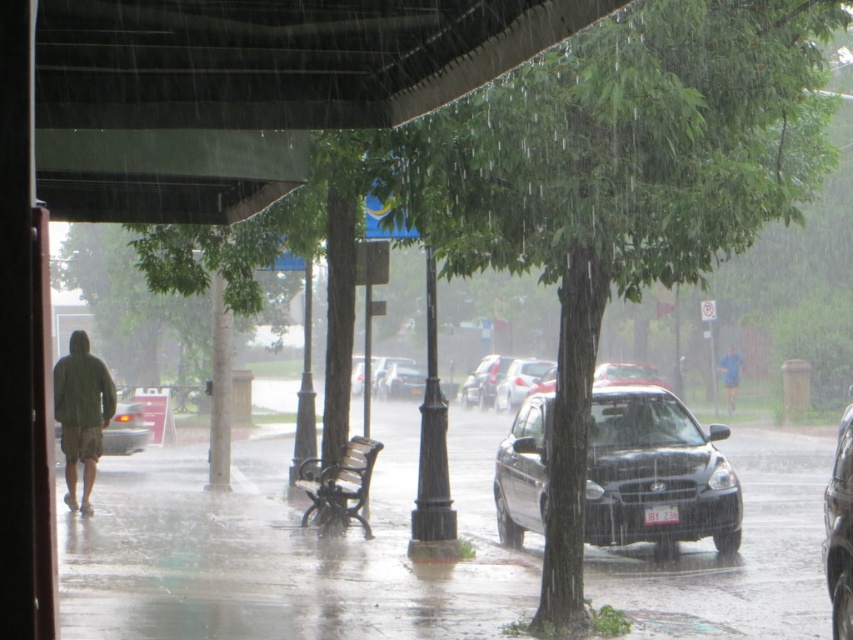
Question: Is shiny black suv at center above wooden bench at center?

Choices:
 (A) no
 (B) yes

Answer: (B)

Question: Is black matte car at center below blue fabric person at center-right?

Choices:
 (A) yes
 (B) no

Answer: (A)

Question: Among these points, which one is nearest to the camera?

Choices:
 (A) (636, 497)
 (B) (834, 544)

Answer: (B)

Question: Does shiny black suv at center have a lesser width compared to blue fabric person at center-right?

Choices:
 (A) no
 (B) yes

Answer: (A)

Question: Estimate the real-world distances between objects in this image. Which object is closer to the silver metallic sedan at center?

Choices:
 (A) green matte jacket at left
 (B) wooden bench at center

Answer: (B)

Question: Which object appears closest to the camera in this image?

Choices:
 (A) satin silver sedan at center
 (B) green matte jacket at left
 (C) black matte car at center

Answer: (C)